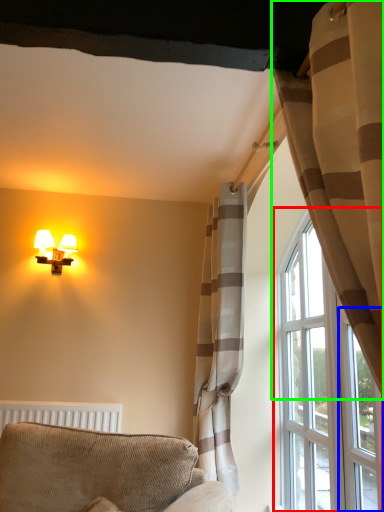
Question: Which object is positioned closest to window (highlighted by a red box)? Select from glass door (highlighted by a blue box) and curtain (highlighted by a green box).

Choices:
 (A) glass door
 (B) curtain

Answer: (A)